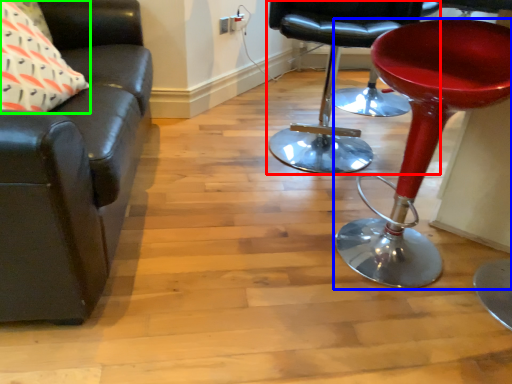
Question: Which is nearer to the chair (highlighted by a red box)? stool (highlighted by a blue box) or pillow (highlighted by a green box).

Choices:
 (A) stool
 (B) pillow

Answer: (A)